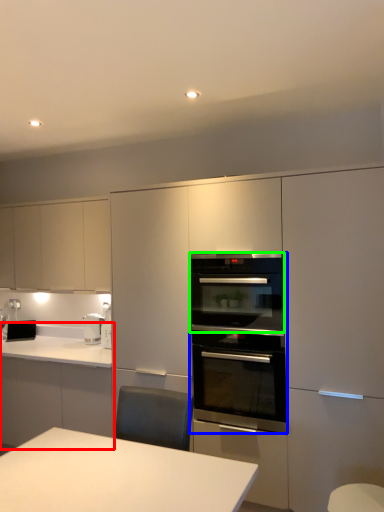
Question: Which is nearer to the countertop (highlighted by a red box)? kitchen appliance (highlighted by a blue box) or oven (highlighted by a green box).

Choices:
 (A) kitchen appliance
 (B) oven

Answer: (A)